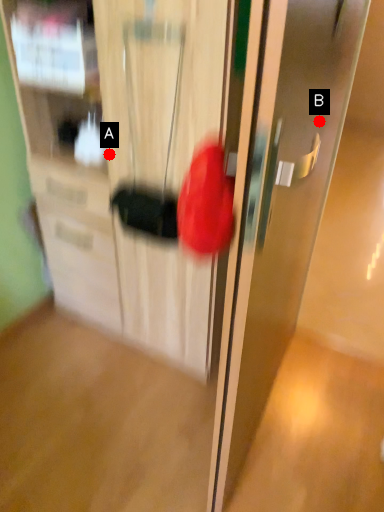
Question: Two points are circled on the image, labeled by A and B beside each circle. Which point is further to the camera?

Choices:
 (A) A is further
 (B) B is further

Answer: (A)